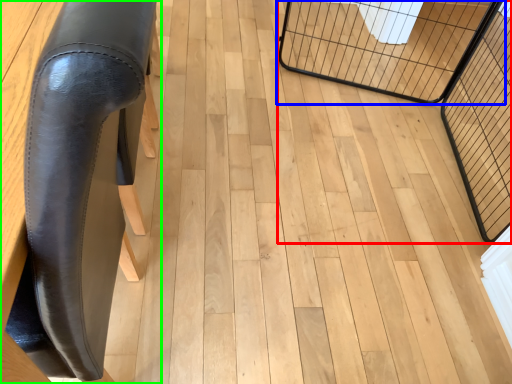
Question: Which is nearer to the cage (highlighted by a red box)? cage (highlighted by a blue box) or furniture (highlighted by a green box).

Choices:
 (A) cage
 (B) furniture

Answer: (A)